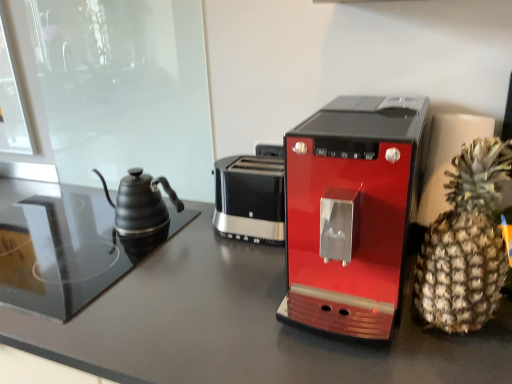
Question: Relative to matte black kettle at left, is brown spiky pineapple at right in front or behind?

Choices:
 (A) behind
 (B) front

Answer: (B)

Question: Does point (440, 223) appear closer or farther from the camera than point (141, 231)?

Choices:
 (A) farther
 (B) closer

Answer: (B)

Question: Which is nearer to the black plastic toaster at center?

Choices:
 (A) shiny red coffee maker at center
 (B) brown spiky pineapple at right
 (C) matte black table at center
 (D) matte black kettle at left

Answer: (C)

Question: Which is farther from the shiny red coffee maker at center?

Choices:
 (A) matte black kettle at left
 (B) matte black table at center
 (C) brown spiky pineapple at right
 (D) black plastic toaster at center

Answer: (A)